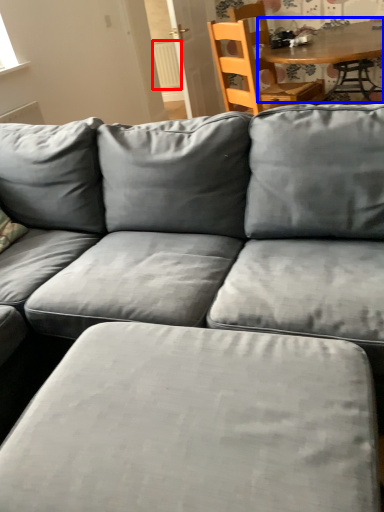
Question: Among these objects, which one is farthest to the camera, radiator (highlighted by a red box) or table (highlighted by a blue box)?

Choices:
 (A) radiator
 (B) table

Answer: (A)